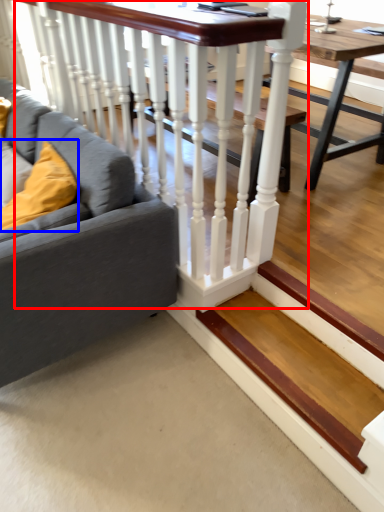
Question: Which object is closer to the camera taking this photo, rail (highlighted by a red box) or pillow (highlighted by a blue box)?

Choices:
 (A) rail
 (B) pillow

Answer: (A)